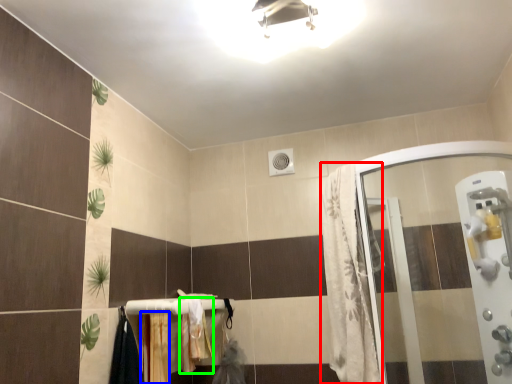
Question: Considering the real-world distances, which object is closest to shower curtain (highlighted by a red box)? curtain (highlighted by a blue box) or bath towel (highlighted by a green box).

Choices:
 (A) curtain
 (B) bath towel

Answer: (B)